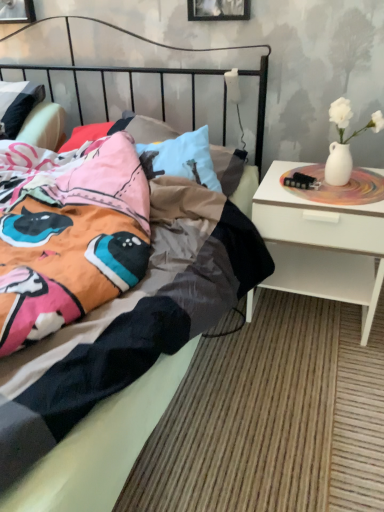
Question: In terms of size, does black matte picture frame at upper center, positioned as the first picture frame in right-to-left order, appear bigger or smaller than metallic silver picture frame at upper left, placed as the second picture frame when sorted from front to back?

Choices:
 (A) big
 (B) small

Answer: (B)

Question: From a real-world perspective, is black matte picture frame at upper center, positioned as the first picture frame in right-to-left order, physically located above or below metallic silver picture frame at upper left, placed as the second picture frame when sorted from front to back?

Choices:
 (A) above
 (B) below

Answer: (A)

Question: Which object is positioned farthest from the black matte picture frame at upper center, which ranks as the 1th picture frame in front-to-back order?

Choices:
 (A) metallic silver picture frame at upper left, placed as the second picture frame when sorted from front to back
 (B) white glossy nightstand at right

Answer: (B)

Question: Which object is the closest to the white glossy nightstand at right?

Choices:
 (A) metallic silver picture frame at upper left, arranged as the 2th picture frame when viewed from the right
 (B) black matte picture frame at upper center, positioned as the first picture frame in right-to-left order

Answer: (B)